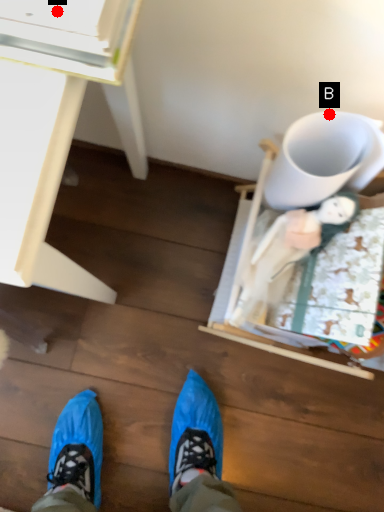
Question: Two points are circled on the image, labeled by A and B beside each circle. Among these points, which one is nearest to the camera?

Choices:
 (A) A is closer
 (B) B is closer

Answer: (A)